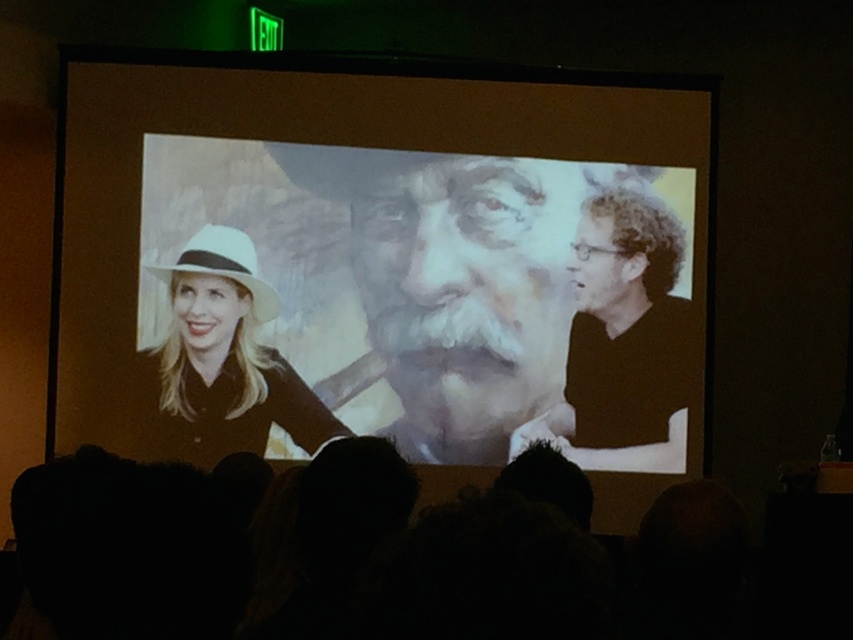
How distant is smooth black shirt at center from white matte hat at left?

31.42 inches

Is point (366, 218) closer to viewer compared to point (256, 406)?

No, it is behind (256, 406).

Where is `smooth black shirt at center`? This screenshot has height=640, width=853. smooth black shirt at center is located at coordinates (492, 292).

Looking at this image, is matte black screen at center to the right of smooth black shirt at center from the viewer's perspective?

No, matte black screen at center is not to the right of smooth black shirt at center.

Describe the element at coordinates (389, 257) in the screenshot. The height and width of the screenshot is (640, 853). I see `matte black screen at center` at that location.

Locate an element on the screen. The image size is (853, 640). matte black screen at center is located at coordinates (389, 257).

Does matte black screen at center come in front of white matte hat at left?

Yes, it is.

Is matte black screen at center wider than white matte hat at left?

Yes, matte black screen at center is wider than white matte hat at left.

Find the location of a particular element. Image resolution: width=853 pixels, height=640 pixels. matte black screen at center is located at coordinates (389, 257).